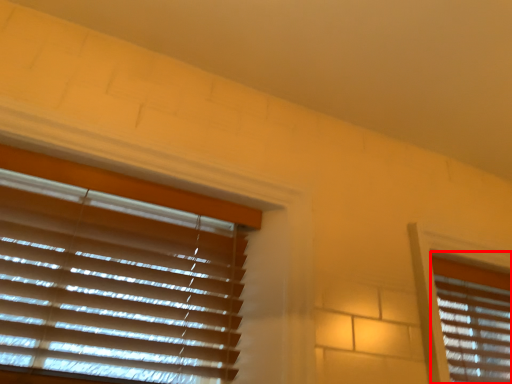
Question: From the image, what is the correct spatial relationship of window blind (annotated by the red box) in relation to window blind?

Choices:
 (A) left
 (B) right

Answer: (B)